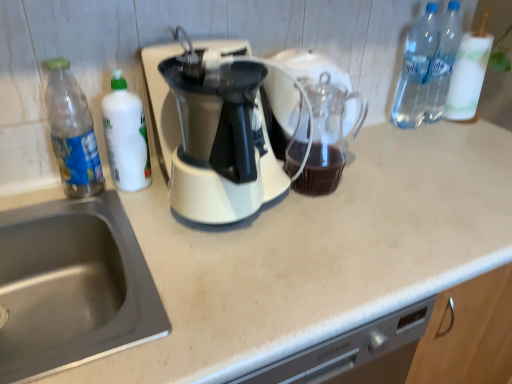
Question: From a real-world perspective, is clear plastic bottles at upper right, placed as the 2th bottle when sorted from right to left, below transparent plastic bottle at left, the first bottle from the left?

Choices:
 (A) no
 (B) yes

Answer: (A)

Question: Are clear plastic bottles at upper right, placed as the 2th bottle when sorted from right to left, and transparent plastic bottle at left, the first bottle from the left, located far from each other?

Choices:
 (A) no
 (B) yes

Answer: (A)

Question: Is clear plastic bottles at upper right, placed as the 2th bottle when sorted from right to left, located outside transparent plastic bottle at left, the first bottle from the left?

Choices:
 (A) yes
 (B) no

Answer: (A)

Question: From the image's perspective, is clear plastic bottles at upper right, the 3th bottle positioned from the left, under transparent plastic bottle at left, which is counted as the 4th bottle, starting from the right?

Choices:
 (A) yes
 (B) no

Answer: (B)

Question: Is clear plastic bottles at upper right, placed as the 2th bottle when sorted from right to left, oriented away from transparent plastic bottle at left, which is counted as the 4th bottle, starting from the right?

Choices:
 (A) yes
 (B) no

Answer: (B)

Question: Is clear plastic bottles at upper right, placed as the 2th bottle when sorted from right to left, directly adjacent to transparent plastic bottle at left, which is counted as the 4th bottle, starting from the right?

Choices:
 (A) no
 (B) yes

Answer: (A)

Question: Are stainless steel sink at lower left and transparent plastic bottle at left, the first bottle from the left, far apart?

Choices:
 (A) no
 (B) yes

Answer: (A)

Question: Considering the relative sizes of stainless steel sink at lower left and transparent plastic bottle at left, which is counted as the 4th bottle, starting from the right, in the image provided, is stainless steel sink at lower left bigger than transparent plastic bottle at left, which is counted as the 4th bottle, starting from the right,?

Choices:
 (A) no
 (B) yes

Answer: (B)

Question: Considering the relative sizes of stainless steel sink at lower left and transparent plastic bottle at left, which is counted as the 4th bottle, starting from the right, in the image provided, is stainless steel sink at lower left wider than transparent plastic bottle at left, which is counted as the 4th bottle, starting from the right,?

Choices:
 (A) no
 (B) yes

Answer: (B)

Question: Is stainless steel sink at lower left oriented away from transparent plastic bottle at left, which is counted as the 4th bottle, starting from the right?

Choices:
 (A) yes
 (B) no

Answer: (B)

Question: Does stainless steel sink at lower left have a greater height compared to transparent plastic bottle at left, the first bottle from the left?

Choices:
 (A) yes
 (B) no

Answer: (B)

Question: From the image's perspective, is stainless steel sink at lower left under transparent plastic bottle at left, which is counted as the 4th bottle, starting from the right?

Choices:
 (A) yes
 (B) no

Answer: (A)

Question: Does transparent glass carafe at center have a lesser height compared to clear plastic bottle at upper right, the 4th bottle when ordered from left to right?

Choices:
 (A) yes
 (B) no

Answer: (A)